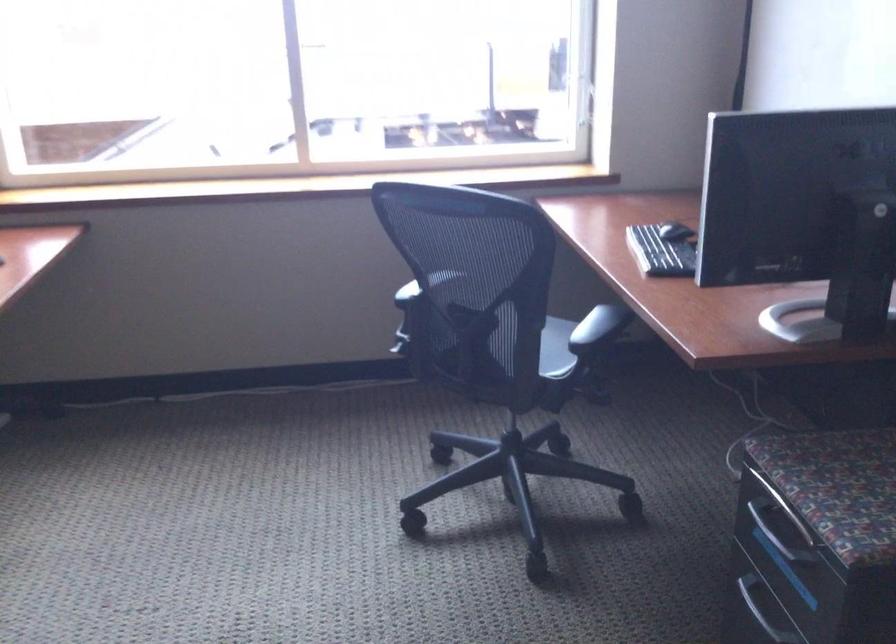
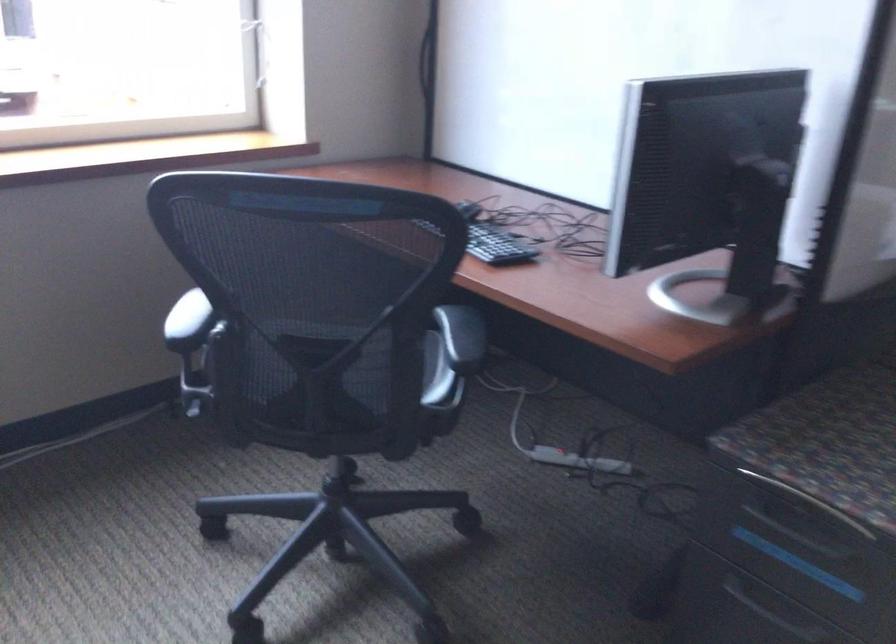
The point at (780, 538) is marked in the first image. Where is the corresponding point in the second image?

(800, 536)